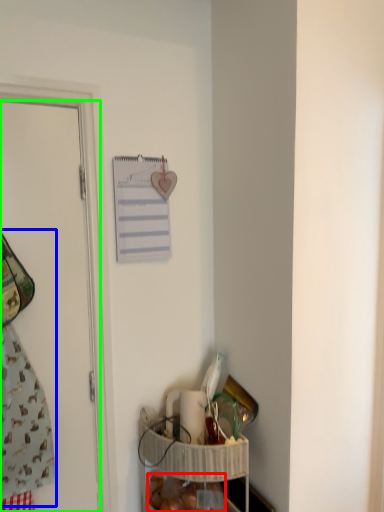
Question: Which object is the farthest from food (highlighted by a red box)? Choose among these: laundry (highlighted by a blue box) or door (highlighted by a green box).

Choices:
 (A) laundry
 (B) door

Answer: (B)